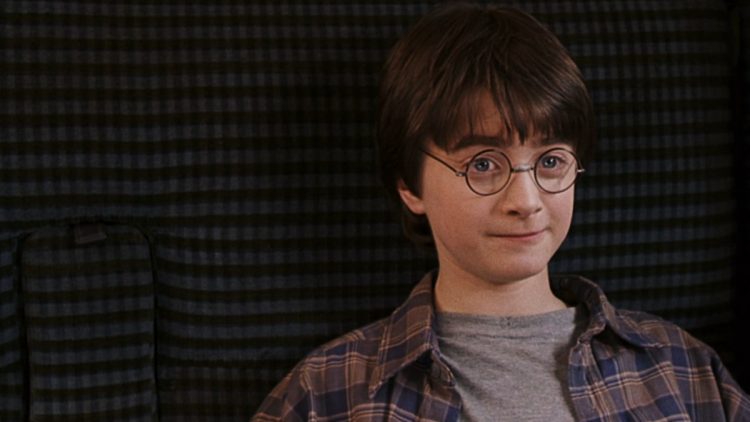
Locate an element on the screen. This screenshot has height=422, width=750. curtain/cushion is located at coordinates (130, 276), (270, 186).